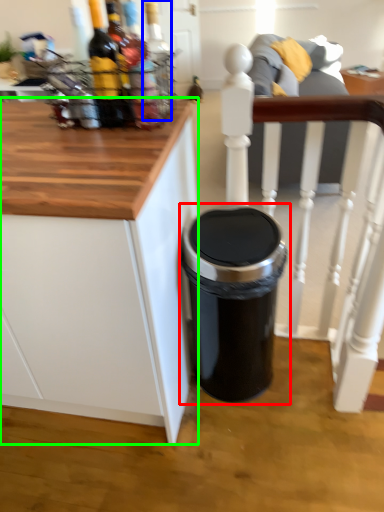
Question: Considering the real-world distances, which object is farthest from waste container (highlighted by a red box)? bottle (highlighted by a blue box) or cabinetry (highlighted by a green box)?

Choices:
 (A) bottle
 (B) cabinetry

Answer: (A)